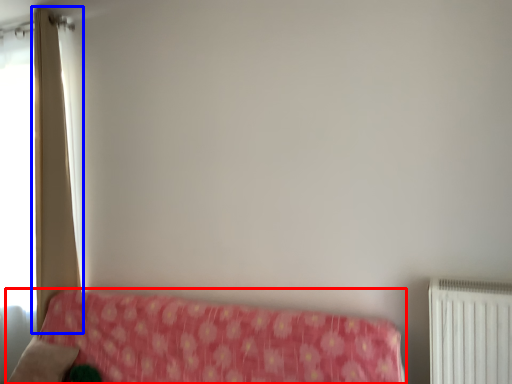
Question: Which object appears closest to the camera in this image, furniture (highlighted by a red box) or curtain (highlighted by a blue box)?

Choices:
 (A) furniture
 (B) curtain

Answer: (A)